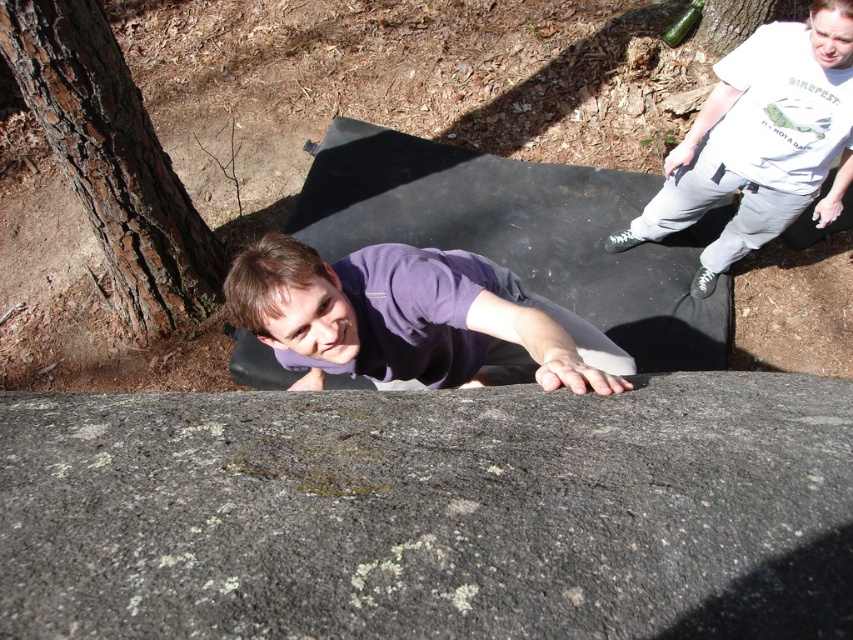
Looking at this image, does purple matte shirt at center appear on the left side of brown rough bark at left?

In fact, purple matte shirt at center is to the right of brown rough bark at left.

Is purple matte shirt at center smaller than brown rough bark at left?

Yes, purple matte shirt at center is smaller than brown rough bark at left.

Who is more forward, (525, 344) or (105, 200)?

Point (525, 344) is in front.

Where is `purple matte shirt at center`? The height and width of the screenshot is (640, 853). purple matte shirt at center is located at coordinates (415, 321).

Locate an element on the screen. The width and height of the screenshot is (853, 640). gray rough rock at center is located at coordinates (431, 513).

Does point (393, 616) come farther from viewer compared to point (721, 109)?

No, (393, 616) is in front of (721, 109).

This screenshot has height=640, width=853. Describe the element at coordinates (431, 513) in the screenshot. I see `gray rough rock at center` at that location.

At what (x,y) coordinates should I click in order to perform the action: click on gray rough rock at center. Please return your answer as a coordinate pair (x, y). This screenshot has height=640, width=853. Looking at the image, I should click on (431, 513).

Who is lower down, gray rough rock at center or brown rough bark at left?

Positioned lower is gray rough rock at center.

Is point (308, 621) positioned behind point (45, 84)?

No, (308, 621) is closer to viewer.

Where is `gray rough rock at center`? This screenshot has height=640, width=853. gray rough rock at center is located at coordinates (431, 513).